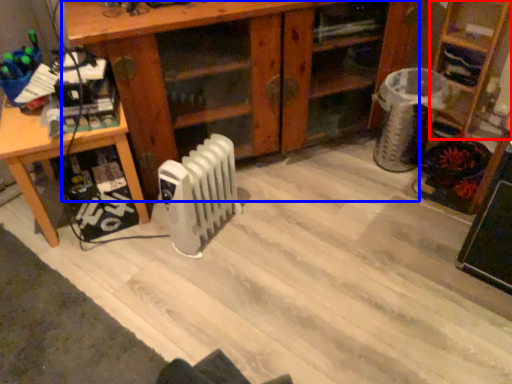
Question: Which object appears farthest to the camera in this image, shelf (highlighted by a red box) or shelf (highlighted by a blue box)?

Choices:
 (A) shelf
 (B) shelf

Answer: (A)